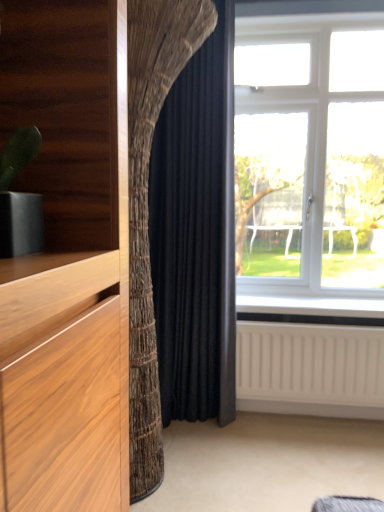
Describe the element at coordinates (310, 369) in the screenshot. This screenshot has width=384, height=512. I see `white textured radiator at lower right` at that location.

Locate an element on the screen. This screenshot has width=384, height=512. white textured radiator at lower right is located at coordinates (310, 369).

In the scene shown: Measure the distance between point [380,240] and camera.

They are 7.57 feet apart.

Measure the distance between white plastic window at right and camera.

A distance of 6.96 feet exists between white plastic window at right and camera.

Image resolution: width=384 pixels, height=512 pixels. Find the location of `white textured radiator at lower right`. white textured radiator at lower right is located at coordinates (310, 369).

Which object is further away from the camera taking this photo, white textured radiator at lower right or white plastic window at right?

Positioned behind is white textured radiator at lower right.

Locate an element on the screen. radiator behind the white plastic window at right is located at coordinates (310, 369).

Is white textured radiator at lower right next to white plastic window at right and touching it?

No, white textured radiator at lower right is not next to white plastic window at right.

From the image's perspective, who appears lower, white textured radiator at lower right or white plastic window at right?

white textured radiator at lower right appears lower in the image.

Is black velvet curtain at center turned away from white plastic window at right?

No.

From the image's perspective, would you say black velvet curtain at center is positioned over white plastic window at right?

No, from the image's perspective, black velvet curtain at center is not above white plastic window at right.

Does black velvet curtain at center come behind white plastic window at right?

No.

From a real-world perspective, is black velvet curtain at center physically located above or below white plastic window at right?

In terms of real-world spatial position, black velvet curtain at center is below white plastic window at right.

Is white plastic window at right in contact with white textured radiator at lower right?

No.

Which is correct: white plastic window at right is inside white textured radiator at lower right, or outside of it?

white plastic window at right cannot be found inside white textured radiator at lower right.

From the image's perspective, which is below, white plastic window at right or white textured radiator at lower right?

white textured radiator at lower right is shown below in the image.

From a real-world perspective, which object rests below the other?

In real-world perspective, black velvet curtain at center is lower.

Is white plastic window at right looking in the opposite direction of black velvet curtain at center?

No.

The image size is (384, 512). Identify the location of curtain located below the white plastic window at right (from the image's perspective). (196, 234).

Which of these two, white textured radiator at lower right or black velvet curtain at center, is bigger?

black velvet curtain at center.

Considering the positions of objects white textured radiator at lower right and black velvet curtain at center in the image provided, who is more to the right, white textured radiator at lower right or black velvet curtain at center?

white textured radiator at lower right is more to the right.

How different are the orientations of white textured radiator at lower right and black velvet curtain at center in degrees?

The facing directions of white textured radiator at lower right and black velvet curtain at center are 0.000159 degrees apart.

Between black velvet curtain at center and white textured radiator at lower right, which one has more height?

black velvet curtain at center is taller.

Which point is more distant from viewer, (232, 173) or (248, 344)?

The point (248, 344) is farther from the camera.

Considering the relative sizes of black velvet curtain at center and white textured radiator at lower right in the image provided, is black velvet curtain at center thinner than white textured radiator at lower right?

No, black velvet curtain at center is not thinner than white textured radiator at lower right.

This screenshot has width=384, height=512. I want to click on window in front of the white textured radiator at lower right, so click(x=310, y=164).

Where is `window located behind the black velvet curtain at center`? window located behind the black velvet curtain at center is located at coordinates (310, 164).

From the picture: Looking at the image, which one is located further to white plastic window at right, black velvet curtain at center or white textured radiator at lower right?

The object further to white plastic window at right is white textured radiator at lower right.

Which object lies further to the anchor point white plastic window at right, white textured radiator at lower right or black velvet curtain at center?

The object further to white plastic window at right is white textured radiator at lower right.

Considering their positions, is white textured radiator at lower right positioned closer to black velvet curtain at center than white plastic window at right?

Among the two, white textured radiator at lower right is located nearer to black velvet curtain at center.

Looking at the image, which one is located further to white textured radiator at lower right, black velvet curtain at center or white plastic window at right?

white plastic window at right is positioned further to the anchor white textured radiator at lower right.

When comparing their distances from black velvet curtain at center, does white plastic window at right or white textured radiator at lower right seem further?

Based on the image, white plastic window at right appears to be further to black velvet curtain at center.

Considering their positions, is white plastic window at right positioned closer to white textured radiator at lower right than black velvet curtain at center?

The object closer to white textured radiator at lower right is black velvet curtain at center.

This screenshot has height=512, width=384. I want to click on curtain between white plastic window at right and white textured radiator at lower right in the up-down direction, so click(x=196, y=234).